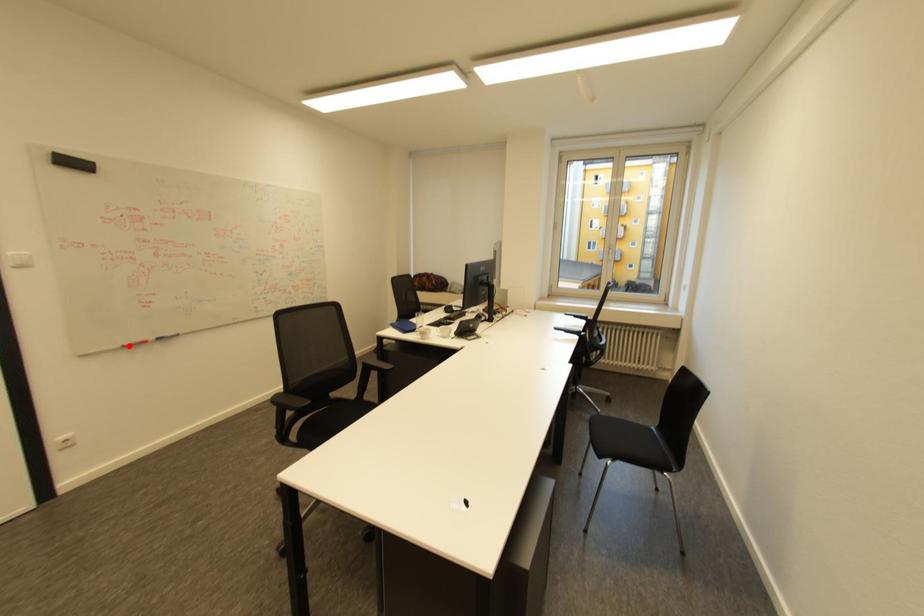
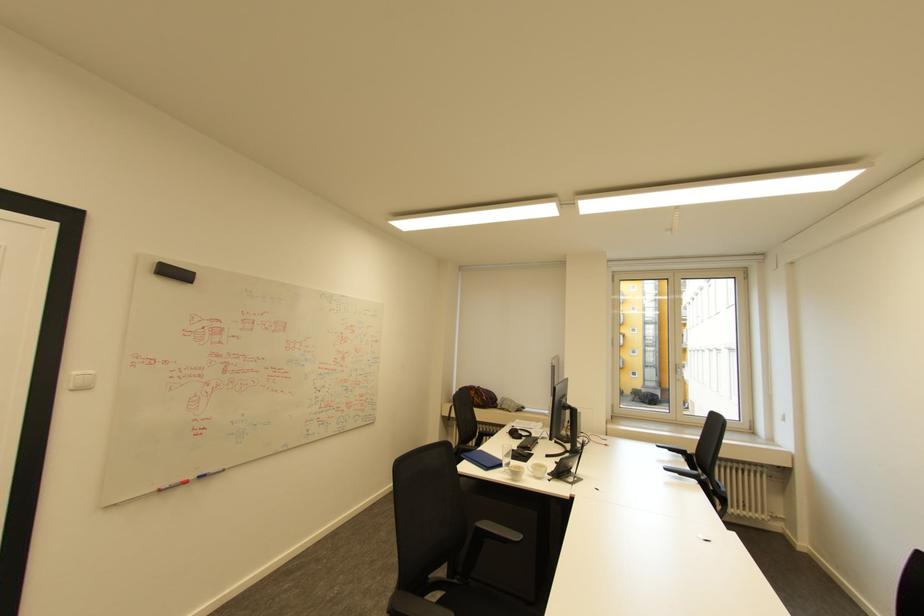
In the second image, find the point that corresponds to the highlighted location in the first image.

(165, 490)